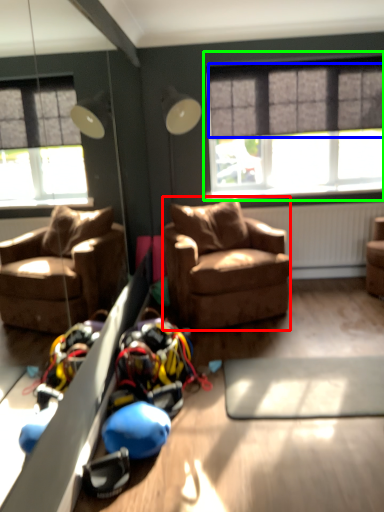
Question: Which object is the farthest from studio couch (highlighted by a red box)? Choose among these: curtain (highlighted by a blue box) or window (highlighted by a green box).

Choices:
 (A) curtain
 (B) window

Answer: (A)